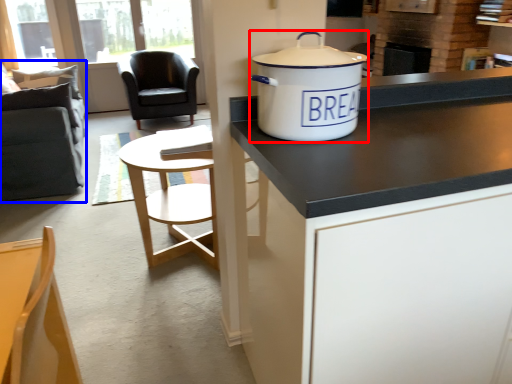
Question: Which point is further to the camera, cooker (highlighted by a red box) or swivel chair (highlighted by a blue box)?

Choices:
 (A) cooker
 (B) swivel chair

Answer: (B)